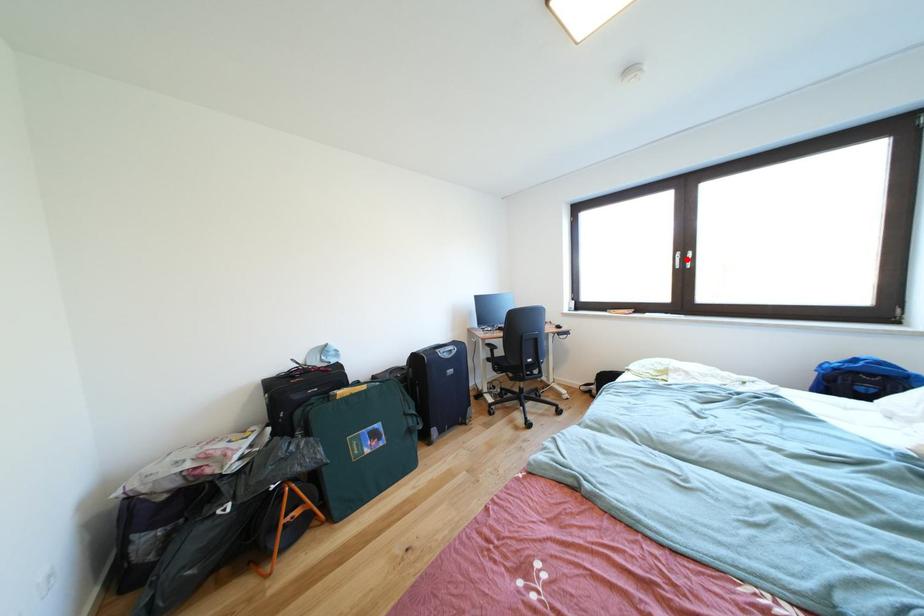
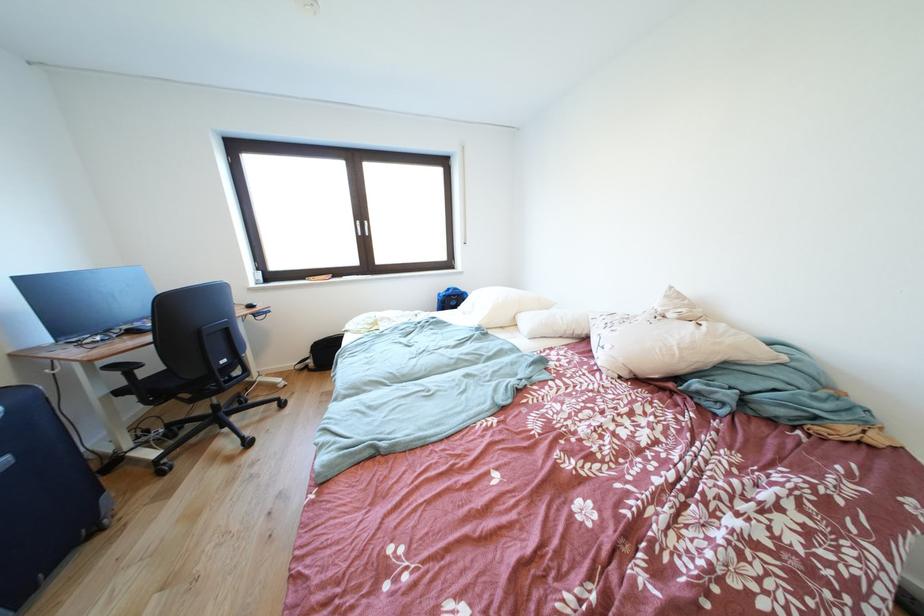
Question: I am providing you with two images of the same scene from different viewpoints. A red point is shown in image1. For the corresponding object point in image2, is it positioned nearer or farther from the camera?

Choices:
 (A) Nearer
 (B) Farther

Answer: (A)